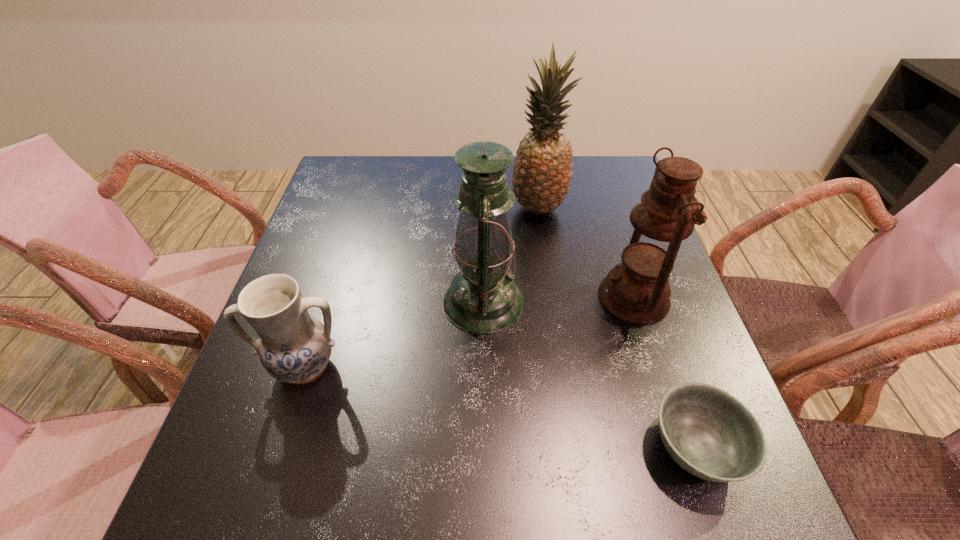
Where is `pineapple`? The height and width of the screenshot is (540, 960). pineapple is located at coordinates (542, 171).

Identify the location of the left oil lamp. (482, 299).

Where is `the shorter oil lamp`? the shorter oil lamp is located at coordinates (637, 290).

Locate an element on the screen. The height and width of the screenshot is (540, 960). the right oil lamp is located at coordinates (637, 290).

What are the coordinates of `the leftmost object` in the screenshot? It's located at (294, 347).

Where is `the fourth farthest object`? This screenshot has width=960, height=540. the fourth farthest object is located at coordinates (294, 347).

At what (x,y) coordinates should I click in order to perform the action: click on the shortest object. Please return your answer as a coordinate pair (x, y). The width and height of the screenshot is (960, 540). Looking at the image, I should click on (708, 432).

Image resolution: width=960 pixels, height=540 pixels. In order to click on bowl in this screenshot , I will do `click(708, 432)`.

This screenshot has width=960, height=540. I want to click on free space located 0.230m on the front of the pineapple, so click(550, 291).

Identify the location of free spot located on the right of the left oil lamp. (652, 302).